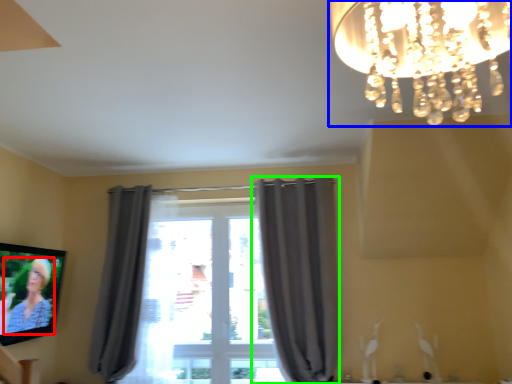
Question: Which is nearer to the person (highlighted by a red box)? lamp (highlighted by a blue box) or curtain (highlighted by a green box).

Choices:
 (A) lamp
 (B) curtain

Answer: (B)